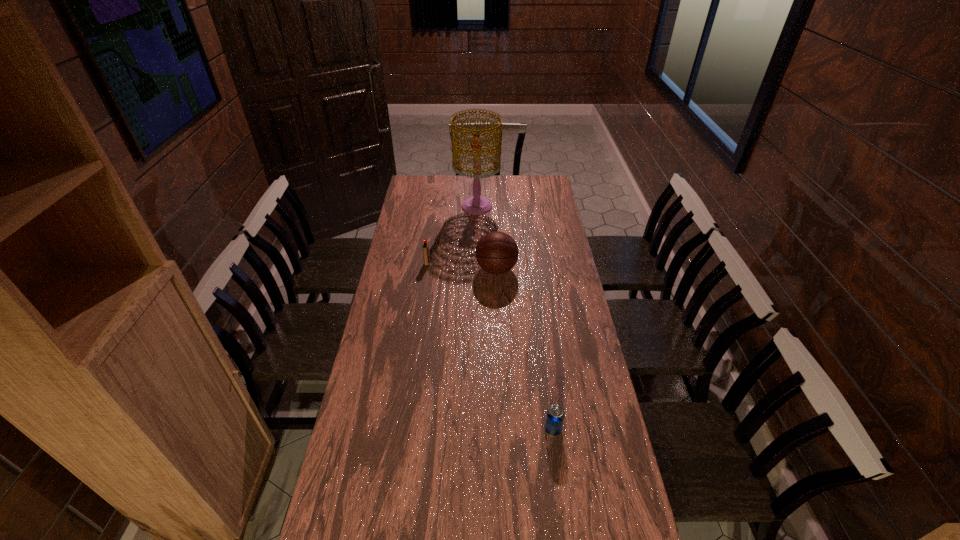
Find the location of a particular element. vacant space that satisfies the following two spatial constraints: 1. on the front side of the leftmost object; 2. on the right side of the rightmost object is located at coordinates (403, 429).

At what (x,y) coordinates should I click in order to perform the action: click on free space that satisfies the following two spatial constraints: 1. on the back side of the third tallest object; 2. on the left side of the lampshade. Please return your answer as a coordinate pair (x, y). The image size is (960, 540). Looking at the image, I should click on tap(435, 207).